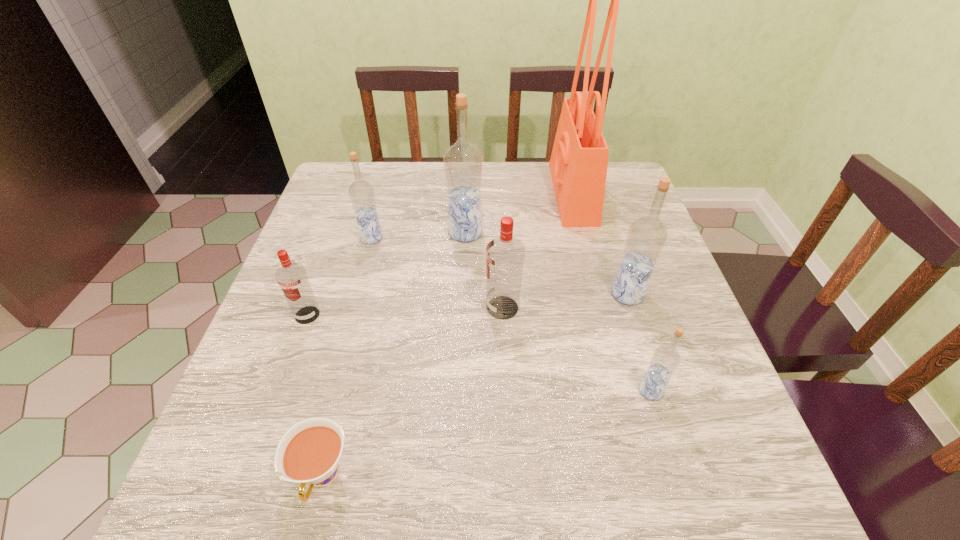
The width and height of the screenshot is (960, 540). In order to click on the third closest blue vodka to the fifth object from right to left in this screenshot , I will do click(665, 360).

I want to click on blue vodka that stands as the second closest to the second smallest blue vodka, so click(646, 238).

Where is `blank space that satisfies the following two spatial constraints: 1. on the logo side of the nearest blue vodka; 2. on the left side of the tallest object`? Image resolution: width=960 pixels, height=540 pixels. blank space that satisfies the following two spatial constraints: 1. on the logo side of the nearest blue vodka; 2. on the left side of the tallest object is located at coordinates (624, 391).

Find the location of `free space that satisfies the following two spatial constraints: 1. on the front label of the bigger red vodka; 2. on the side of the white teacup with the handle`. free space that satisfies the following two spatial constraints: 1. on the front label of the bigger red vodka; 2. on the side of the white teacup with the handle is located at coordinates (511, 476).

The image size is (960, 540). I want to click on vacant region that satisfies the following two spatial constraints: 1. on the logo side of the tote bag; 2. on the right side of the nearest vodka, so click(x=624, y=391).

Locate an element on the screen. The image size is (960, 540). vacant area that satisfies the following two spatial constraints: 1. on the front label of the leftmost vodka; 2. on the left side of the nearest blue vodka is located at coordinates (280, 391).

At what (x,y) coordinates should I click in order to perform the action: click on vacant space that satisfies the following two spatial constraints: 1. on the back side of the nearest vodka; 2. on the logo side of the tallest object. Please return your answer as a coordinate pair (x, y). This screenshot has width=960, height=540. Looking at the image, I should click on (589, 193).